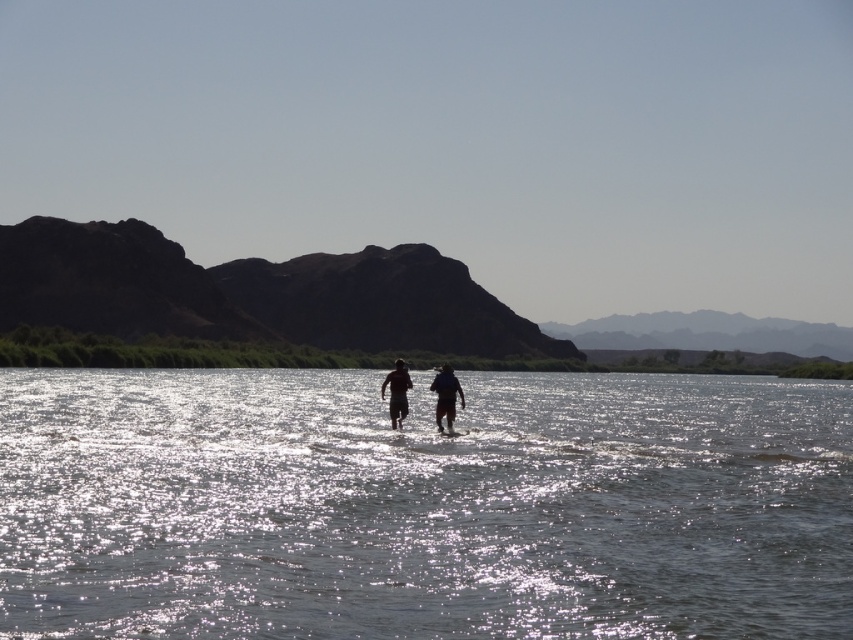
Consider the image. You are a photographer trying to capture the dark blue fabric shirt at center in the image. Based on their position, will the shirt be in the foreground or background of the photo?

The dark blue fabric shirt at center is located at point [445,396], which places it in the foreground of the photo since it is closer to the viewer compared to the background elements.

You are a photographer trying to capture the two figures in the water. Since the dark blue fabric shirt at center and matte black shorts at center are both at the center, which one will appear closer to the camera in the photo?

The dark blue fabric shirt at center appears closer to the camera because it is shorter than the matte black shorts at center, making it visually nearer in the image.